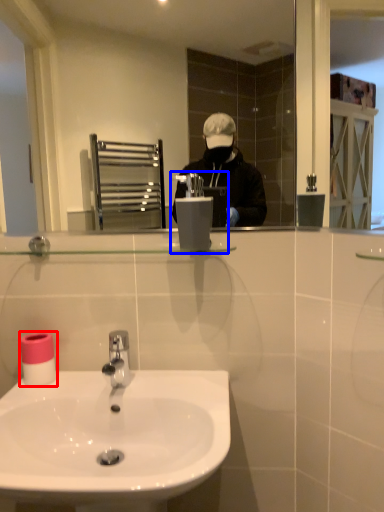
Question: Which of the following is the farthest to the observer, toilet paper (highlighted by a red box) or hand dryer (highlighted by a blue box)?

Choices:
 (A) toilet paper
 (B) hand dryer

Answer: (A)